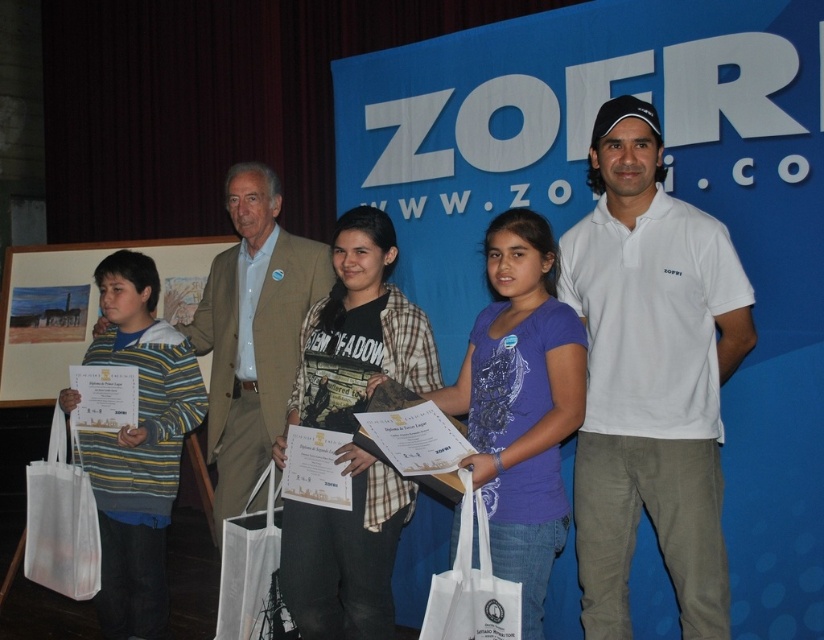
Between white fabric bag at lower left and white mesh bag at lower center, which one appears on the left side from the viewer's perspective?

white fabric bag at lower left is more to the left.

Can you confirm if white fabric bag at lower left is positioned to the right of white mesh bag at lower center?

Incorrect, white fabric bag at lower left is not on the right side of white mesh bag at lower center.

Is point (41, 467) more distant than point (270, 536)?

Yes, point (41, 467) is behind point (270, 536).

Where is `white fabric bag at lower left`? The width and height of the screenshot is (824, 640). white fabric bag at lower left is located at coordinates (61, 522).

Looking at this image, can you confirm if light brown suit at center is positioned below white mesh bag at lower center?

No, light brown suit at center is not below white mesh bag at lower center.

Between light brown suit at center and white mesh bag at lower center, which one appears on the right side from the viewer's perspective?

white mesh bag at lower center is more to the right.

Between point (274, 218) and point (246, 605), which one is positioned behind?

Point (274, 218)

Identify the location of light brown suit at center. Image resolution: width=824 pixels, height=640 pixels. (251, 332).

This screenshot has width=824, height=640. What do you see at coordinates (649, 378) in the screenshot?
I see `white cotton polo shirt at center` at bounding box center [649, 378].

Find the location of a particular element. The width and height of the screenshot is (824, 640). white cotton polo shirt at center is located at coordinates (649, 378).